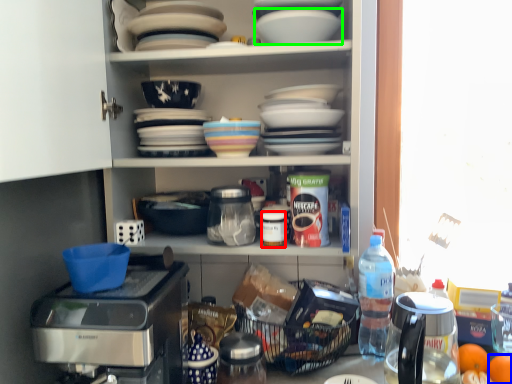
Question: Estimate the real-world distances between objects in this image. Which object is farther from bottle (highlighted by a red box), tangerine (highlighted by a blue box) or tableware (highlighted by a green box)?

Choices:
 (A) tangerine
 (B) tableware

Answer: (A)